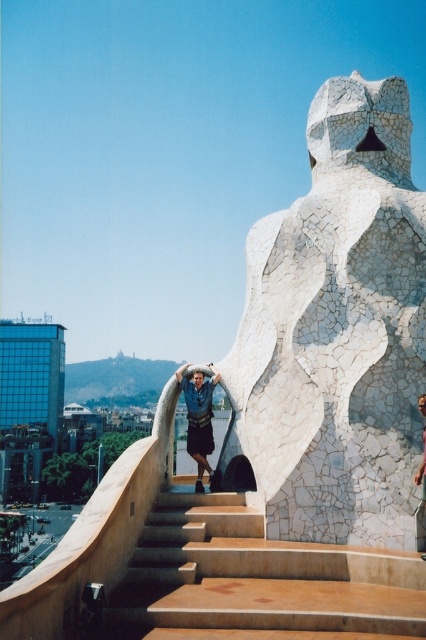
Question: Does white mosaic statue at center have a smaller size compared to brown stone stairs at center?

Choices:
 (A) no
 (B) yes

Answer: (A)

Question: Is white mosaic statue at center thinner than dark blue fabric at center?

Choices:
 (A) no
 (B) yes

Answer: (A)

Question: Which of these objects is positioned farthest from the blue denim shorts at upper center?

Choices:
 (A) dark blue fabric at center
 (B) white mosaic statue at center
 (C) brown stone stairs at center

Answer: (A)

Question: Which of these objects is positioned farthest from the white mosaic statue at center?

Choices:
 (A) brown stone stairs at center
 (B) blue denim shorts at upper center

Answer: (B)

Question: Which object is farther from the camera taking this photo?

Choices:
 (A) brown stone stairs at center
 (B) dark blue fabric at center
 (C) blue denim shorts at upper center
 (D) white mosaic statue at center

Answer: (B)

Question: Is white mosaic statue at center below brown stone stairs at center?

Choices:
 (A) yes
 (B) no

Answer: (B)